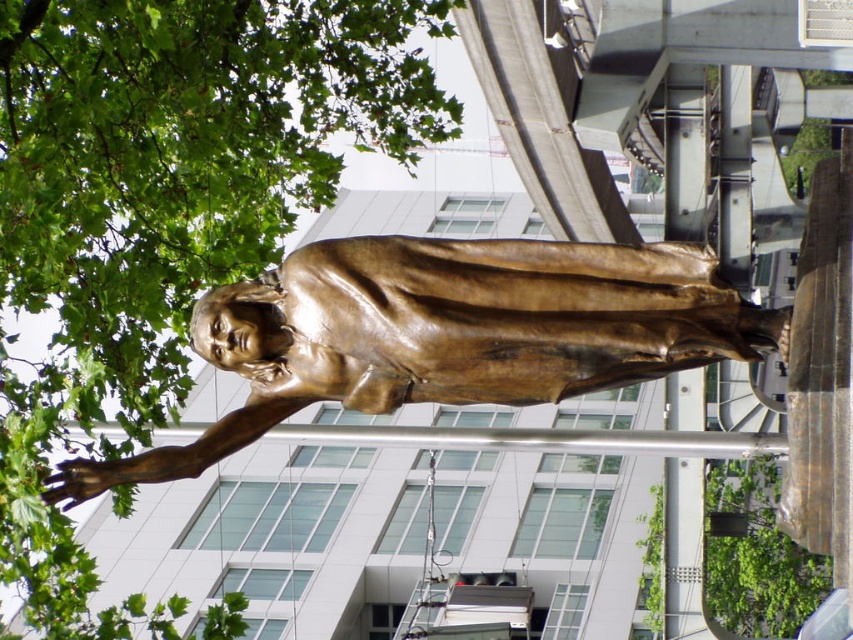
You are an urban planner reviewing this area and want to ensure that the green leafy tree at upper left and the green leafy tree at upper center do not block the view of the bronze statue. Which tree should be pruned first to maintain the statue visibility?

The green leafy tree at upper left should be pruned first because it is taller than the green leafy tree at upper center, making it more likely to obstruct the view of the bronze statue.

You are an urban planner reviewing a city park layout. You notice the green leafy tree at upper left and the bronze statue at center in the proposed design. Based on the spatial arrangement, which object is positioned higher in the image?

The green leafy tree at upper left is located above the bronze statue at center, so it is positioned higher in the image.

You are a city planner who needs to install a new streetlight between the bronze statue at center and the modern building in the background. The streetlight requires a minimum of 30 meters of space between the statue and the building to function properly. Based on the scene, will the current distance allow for the installation?

The distance between the bronze statue at center and the modern building in the background is 27.38 meters, which is less than the required 30 meters. Therefore, the current distance does not allow for the installation of the streetlight with the required spacing.